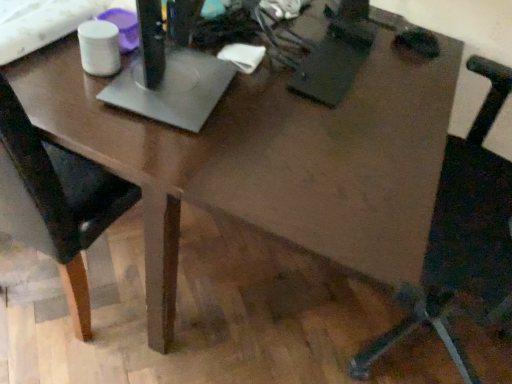
Question: Is black leather chair at left, the second chair viewed from the right, in front of or behind black leather chair at right, which is the 2th chair from left to right, in the image?

Choices:
 (A) front
 (B) behind

Answer: (B)

Question: From the image's perspective, is black leather chair at left, which is counted as the first chair, starting from the left, positioned above or below black leather chair at right, which is the 2th chair from left to right?

Choices:
 (A) above
 (B) below

Answer: (A)

Question: From a real-world perspective, is black leather chair at left, which is counted as the first chair, starting from the left, positioned above or below black leather chair at right, which is the 2th chair from left to right?

Choices:
 (A) below
 (B) above

Answer: (A)

Question: Is black leather chair at right, which is the 1th chair in right-to-left order, inside the boundaries of black leather chair at left, which is counted as the first chair, starting from the left, or outside?

Choices:
 (A) inside
 (B) outside

Answer: (B)

Question: Considering the positions of black leather chair at right, which is the 2th chair from left to right, and black leather chair at left, which is counted as the first chair, starting from the left, in the image, is black leather chair at right, which is the 2th chair from left to right, taller or shorter than black leather chair at left, which is counted as the first chair, starting from the left,?

Choices:
 (A) short
 (B) tall

Answer: (B)

Question: Visually, is black leather chair at right, which is the 2th chair from left to right, positioned to the left or to the right of black leather chair at left, the second chair viewed from the right?

Choices:
 (A) right
 (B) left

Answer: (A)

Question: Is black leather chair at right, which is the 2th chair from left to right, in front of or behind black leather chair at left, which is counted as the first chair, starting from the left, in the image?

Choices:
 (A) behind
 (B) front

Answer: (B)